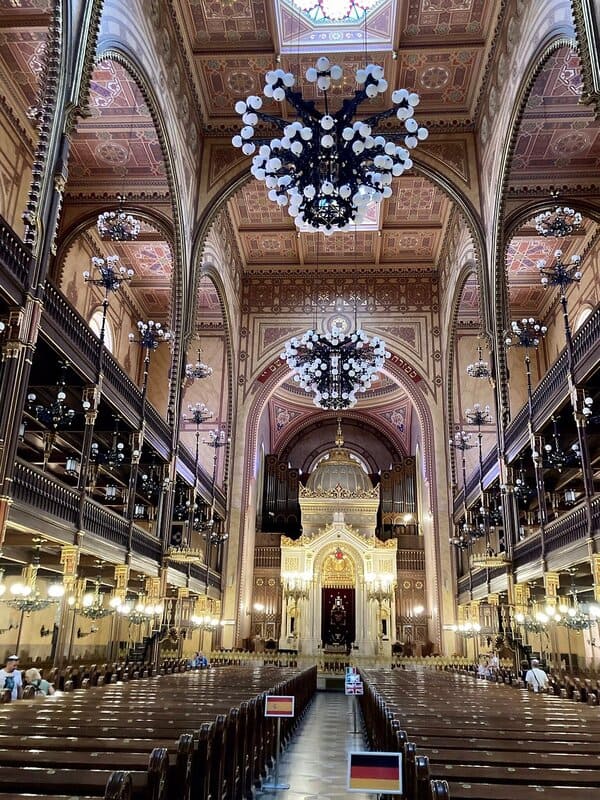
Identify the location of place to sit. Image resolution: width=600 pixels, height=800 pixels. (130, 758).